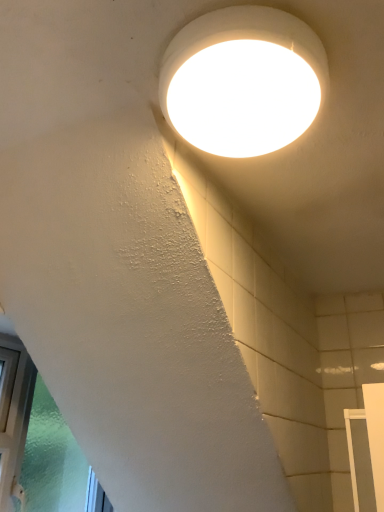
Question: Considering the positions of point (74, 501) and point (162, 75), is point (74, 501) closer or farther from the camera than point (162, 75)?

Choices:
 (A) closer
 (B) farther

Answer: (B)

Question: Is green frosted glass at lower left bigger or smaller than white glossy light fixture at upper center?

Choices:
 (A) big
 (B) small

Answer: (A)

Question: Which is correct: green frosted glass at lower left is inside white glossy light fixture at upper center, or outside of it?

Choices:
 (A) outside
 (B) inside

Answer: (A)

Question: Looking at the image, does white glossy light fixture at upper center seem bigger or smaller compared to green frosted glass at lower left?

Choices:
 (A) small
 (B) big

Answer: (A)

Question: Would you say white glossy light fixture at upper center is inside or outside green frosted glass at lower left?

Choices:
 (A) inside
 (B) outside

Answer: (B)

Question: From a real-world perspective, is white glossy light fixture at upper center above or below green frosted glass at lower left?

Choices:
 (A) above
 (B) below

Answer: (A)

Question: From the image's perspective, is white glossy light fixture at upper center positioned above or below green frosted glass at lower left?

Choices:
 (A) below
 (B) above

Answer: (B)